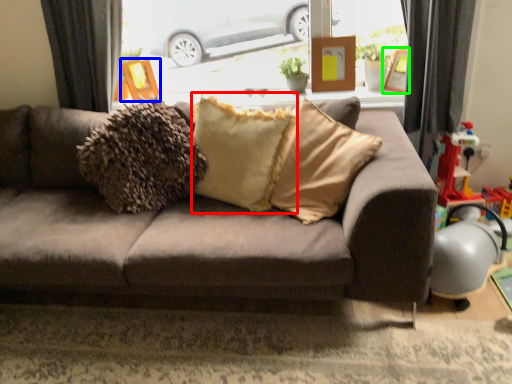
Question: Which object is the closest to the pillow (highlighted by a red box)? Choose among these: picture frame (highlighted by a blue box) or picture frame (highlighted by a green box).

Choices:
 (A) picture frame
 (B) picture frame

Answer: (A)